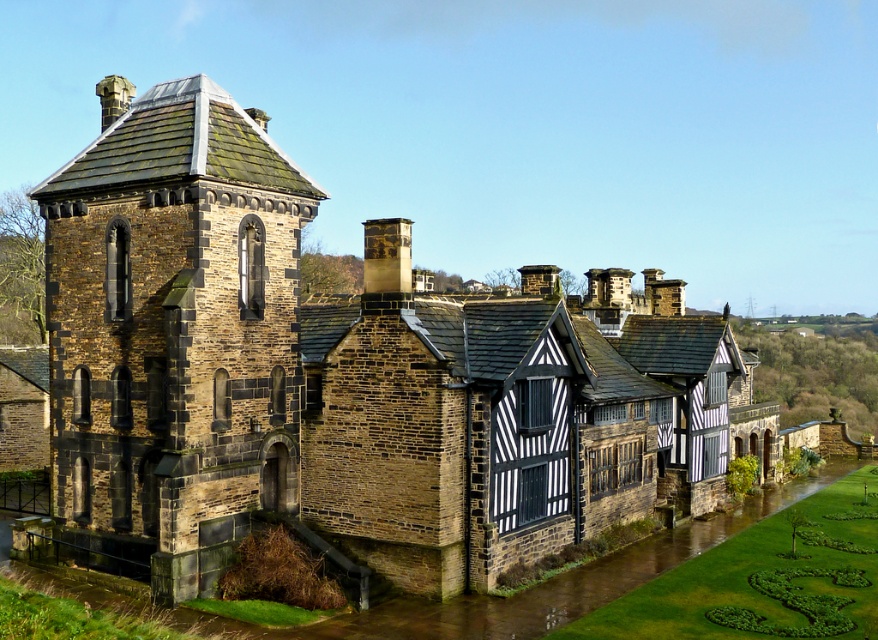
You are standing in front of the historic building complex. There are two points marked on the building, one at coordinates point (185, 360) and another at point (371, 248). Which of these points is closer to you?

Point (185, 360) is closer to the viewer than point (371, 248).

You are standing in front of the historic building complex. You notice the brown stone flood at lower left and the dark brown stone chimney at center. Which of these two objects is nearer to you?

The brown stone flood at lower left is closer to the viewer than the dark brown stone chimney at center.

You are a delivery person with a cart that is 10 meters wide. You need to navigate between the brown stone tower at left and the brown stone flood at lower left. Can your cart fit through the space between them?

The brown stone tower at left and brown stone flood at lower left are 10.09 meters apart from each other. Since your cart is 10 meters wide, it can fit through the space between them as the distance is slightly larger than the cart.